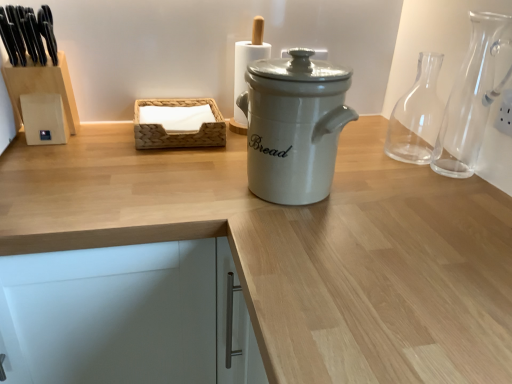
Question: Considering the relative sizes of white ceramic bread bin at center and woven wood tissue box at center in the image provided, is white ceramic bread bin at center bigger than woven wood tissue box at center?

Choices:
 (A) no
 (B) yes

Answer: (B)

Question: Is white ceramic bread bin at center shorter than woven wood tissue box at center?

Choices:
 (A) no
 (B) yes

Answer: (A)

Question: Does white ceramic bread bin at center appear on the left side of woven wood tissue box at center?

Choices:
 (A) no
 (B) yes

Answer: (A)

Question: Could you tell me if white ceramic bread bin at center is turned towards woven wood tissue box at center?

Choices:
 (A) yes
 (B) no

Answer: (B)

Question: From a real-world perspective, is white ceramic bread bin at center positioned over woven wood tissue box at center based on gravity?

Choices:
 (A) no
 (B) yes

Answer: (B)

Question: From the image's perspective, is white ceramic bread bin at center below woven wood tissue box at center?

Choices:
 (A) no
 (B) yes

Answer: (B)

Question: Can you confirm if transparent glass carafe at right, the 1th glass vase in the front-to-back sequence, is positioned to the left of white matte cabinet at lower left?

Choices:
 (A) no
 (B) yes

Answer: (A)

Question: Is transparent glass carafe at right, the 1th glass vase in the front-to-back sequence, not inside white matte cabinet at lower left?

Choices:
 (A) no
 (B) yes

Answer: (B)

Question: Does transparent glass carafe at right, positioned as the 2th glass vase in back-to-front order, have a lesser width compared to white matte cabinet at lower left?

Choices:
 (A) no
 (B) yes

Answer: (B)

Question: Considering the relative sizes of transparent glass carafe at right, the 1th glass vase in the front-to-back sequence, and white matte cabinet at lower left in the image provided, is transparent glass carafe at right, the 1th glass vase in the front-to-back sequence, smaller than white matte cabinet at lower left?

Choices:
 (A) no
 (B) yes

Answer: (B)

Question: Considering the relative sizes of transparent glass carafe at right, positioned as the 2th glass vase in back-to-front order, and white matte cabinet at lower left in the image provided, is transparent glass carafe at right, positioned as the 2th glass vase in back-to-front order, wider than white matte cabinet at lower left?

Choices:
 (A) yes
 (B) no

Answer: (B)

Question: Is transparent glass carafe at right, positioned as the 2th glass vase in back-to-front order, directly adjacent to white matte cabinet at lower left?

Choices:
 (A) no
 (B) yes

Answer: (A)

Question: Could you tell me if transparent glass carafe at right, the 1th glass vase in the front-to-back sequence, is facing woven wood tissue box at center?

Choices:
 (A) no
 (B) yes

Answer: (A)